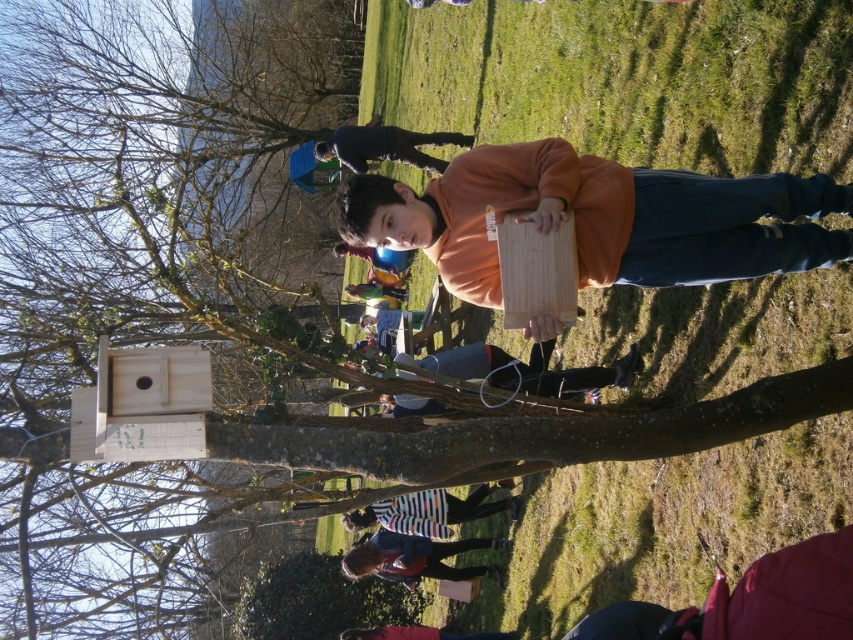
You are standing in the scene and notice two striped fabrics. One is the striped fabric shirt at lower center and the other is the striped fabric at center. Which striped fabric is closer to you?

The striped fabric shirt at lower center is closer to you since it is only 20.47 inches away from the striped fabric at center.

You are organizing an outdoor event and need to place a sign on the matte wood board at center and a banner on the striped fabric at center. According to the scene, which object should you place first to ensure proper alignment with the event setup?

The matte wood board at center is positioned on the right side of striped fabric at center, so you should place the banner on the striped fabric at center first to ensure proper alignment with the event setup.

You are a photographer trying to capture a photo of the striped fabric shirt at lower center and the striped fabric at center. Which object should you focus on first if you want to include both in your frame without moving the camera?

You should focus on the striped fabric shirt at lower center first because it is much taller than the striped fabric at center, so it will occupy more space in the frame and ensure both are visible.